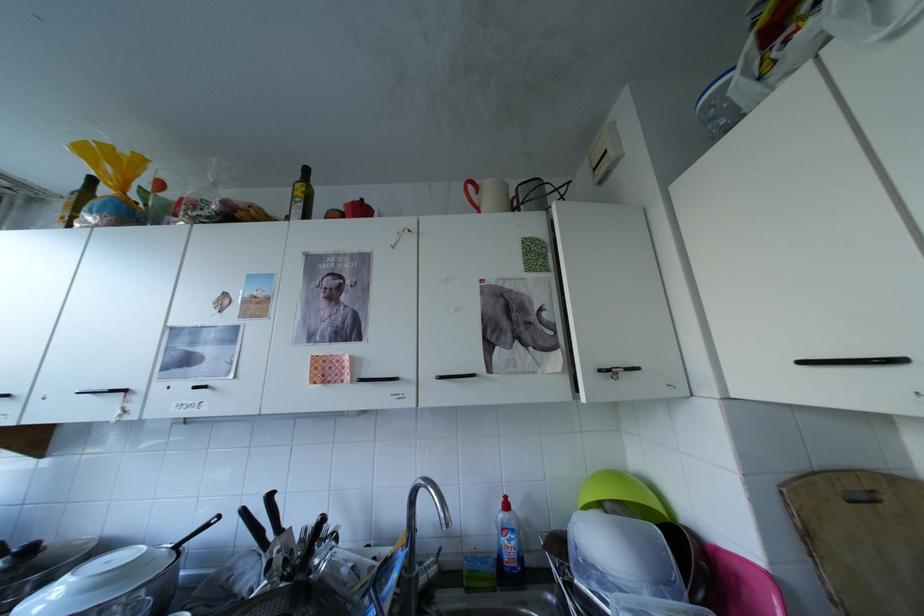
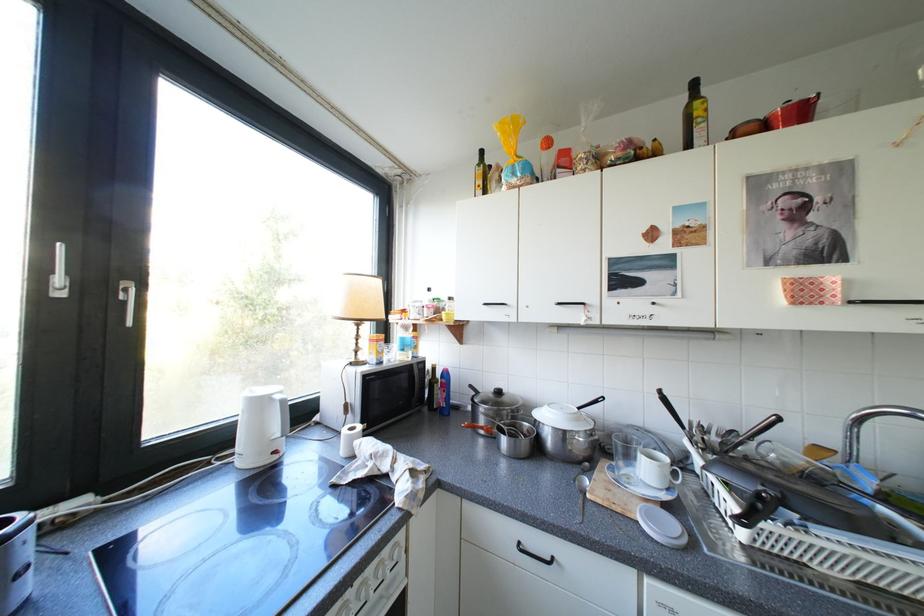
Question: The camera is either moving clockwise (left) or counter-clockwise (right) around the object. The first image is from the beginning of the video and the second image is from the end. Is the camera moving left or right when shooting the video?

Choices:
 (A) Left
 (B) Right

Answer: (B)